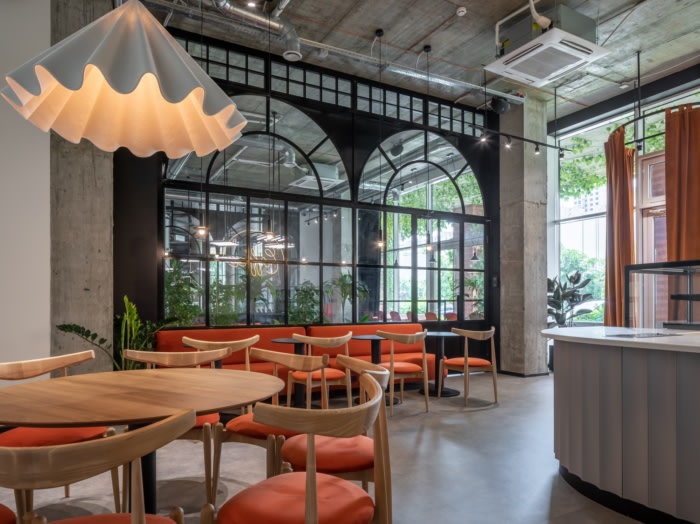
Identify the location of chairs in the main room. Image resolution: width=700 pixels, height=524 pixels. (458, 366), (414, 369), (329, 347), (244, 348), (200, 359), (38, 366), (287, 376), (369, 371), (343, 431), (80, 512).